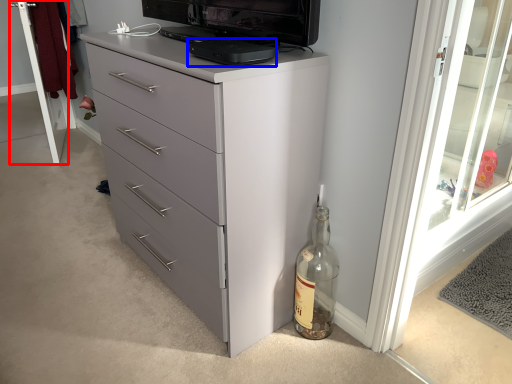
Question: Which point is closer to the camera, screen door (highlighted by a red box) or appliance (highlighted by a blue box)?

Choices:
 (A) screen door
 (B) appliance

Answer: (B)